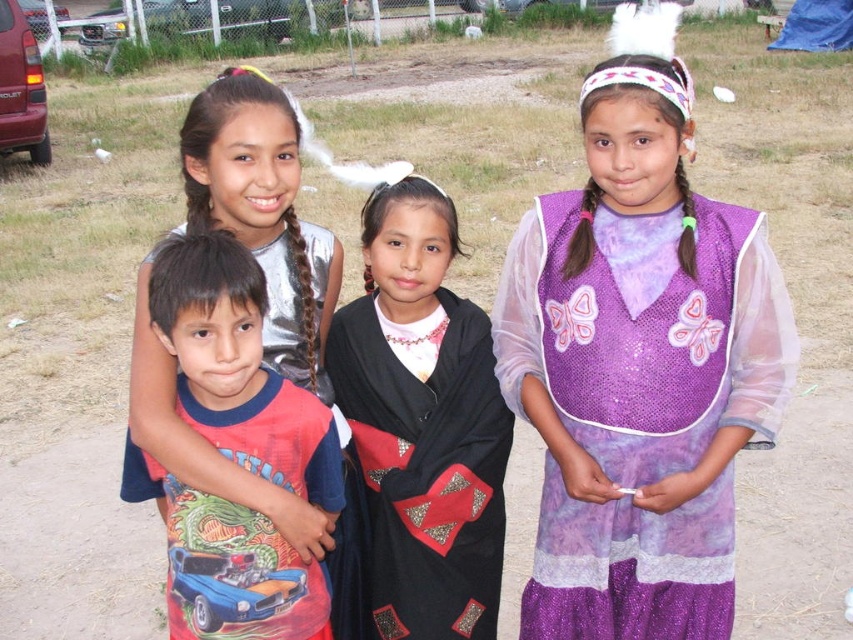
You are a photographer setting up a shoot in the described scene. You have two main subjects to focus on, the purple sequined dress at center and the black sequined shawl at center. Based on their positions and sizes, which one should you prioritize in your composition to ensure it stands out more?

The purple sequined dress at center has a greater height compared to the black sequined shawl at center, so prioritizing the purple sequined dress at center in the composition will make it stand out more due to its larger size.